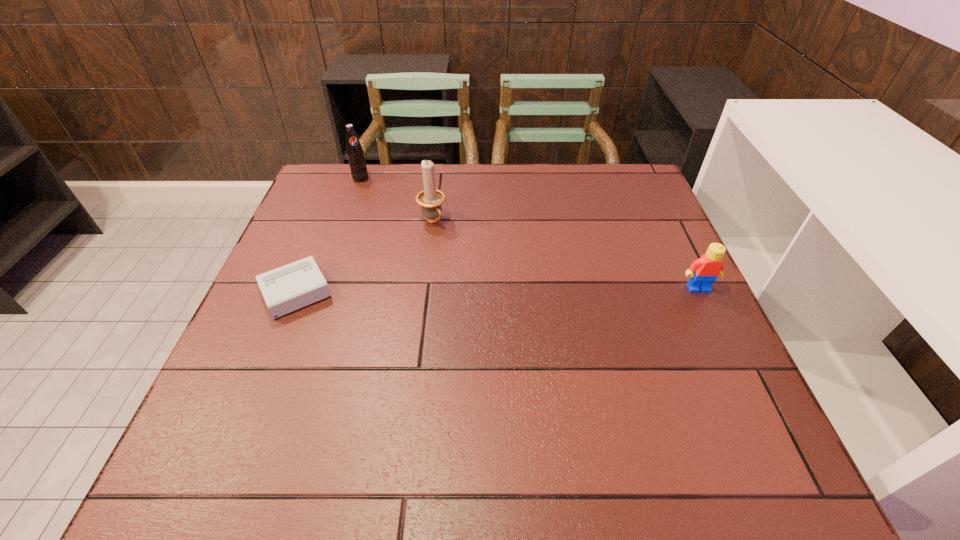
Image resolution: width=960 pixels, height=540 pixels. I want to click on vacant space that satisfies the following two spatial constraints: 1. on the front side of the pop; 2. on the left side of the second object from right to left, so click(346, 221).

You are a GUI agent. You are given a task and a screenshot of the screen. Output one action in this format:
    pyautogui.click(x=<x>, y=<y>)
    Task: Click on the vacant region that satisfies the following two spatial constraints: 1. on the back side of the pop; 2. on the left side of the shortest object
    This screenshot has width=960, height=540.
    Given the screenshot: What is the action you would take?
    pyautogui.click(x=341, y=179)